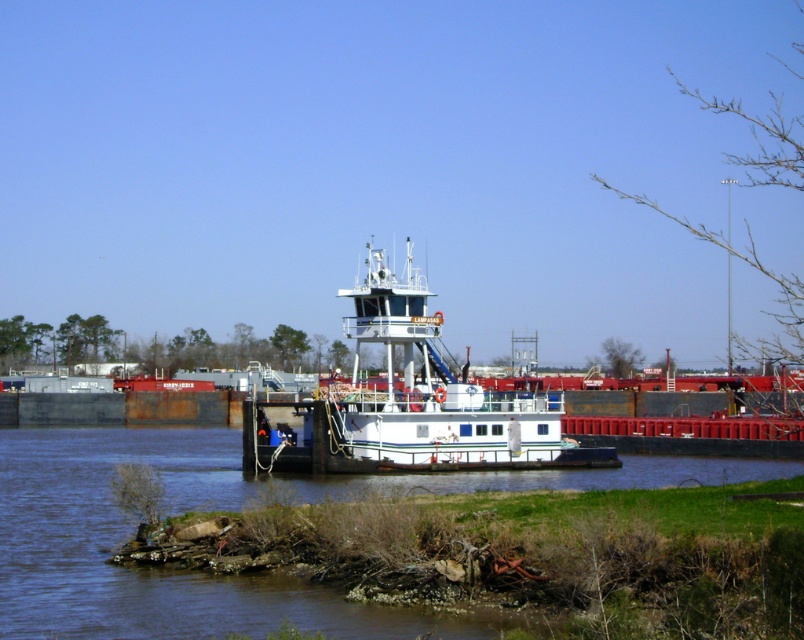
Question: Which point is farther to the camera?

Choices:
 (A) blue painted steel river at center
 (B) white matte tugboat at center

Answer: (B)

Question: Is blue painted steel river at center behind white matte tugboat at center?

Choices:
 (A) no
 (B) yes

Answer: (A)

Question: Is blue painted steel river at center behind white matte tugboat at center?

Choices:
 (A) no
 (B) yes

Answer: (A)

Question: Where is blue painted steel river at center located in relation to white matte tugboat at center in the image?

Choices:
 (A) left
 (B) right

Answer: (A)